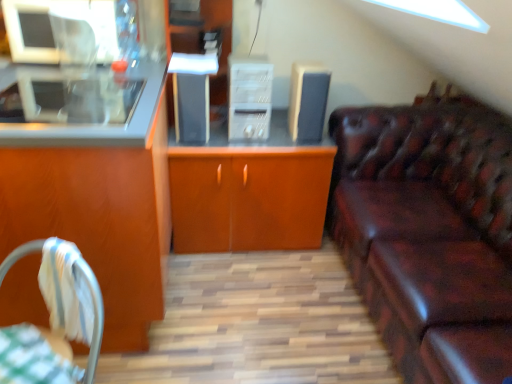
Question: Is green checkered tablecloth at lower left in front of or behind matte wood cabinet at left, acting as the second cabinetry starting from the right, in the image?

Choices:
 (A) front
 (B) behind

Answer: (A)

Question: Does point (37, 327) appear closer or farther from the camera than point (68, 11)?

Choices:
 (A) closer
 (B) farther

Answer: (A)

Question: Which object is the farthest from the wooden cabinet at center, the 2th cabinetry when ordered from left to right?

Choices:
 (A) leather couch at right
 (B) white plastic file cabinet at center
 (C) matte wood cabinet at left, which is the first cabinetry in left-to-right order
 (D) green checkered tablecloth at lower left
 (E) satin black speaker at center, which appears as the second appliance when viewed from the right

Answer: (D)

Question: Estimate the real-world distances between objects in this image. Which object is closer to the white plastic file cabinet at center?

Choices:
 (A) satin black speaker at center, which ranks as the first appliance in left-to-right order
 (B) slate gray fabric speaker at upper center, marked as the 2th appliance in a left-to-right arrangement
 (C) matte wood cabinet at left, acting as the second cabinetry starting from the right
 (D) wooden cabinet at center, which is the 1th cabinetry in right-to-left order
 (E) white fabric chair at lower left

Answer: (B)